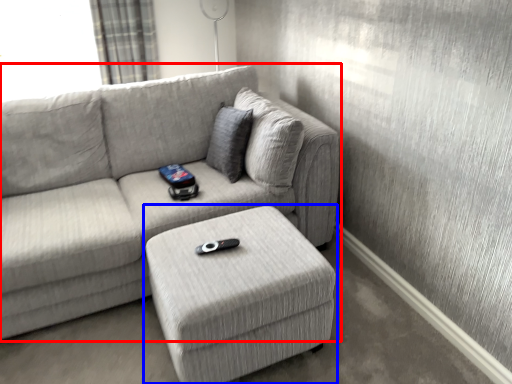
Question: Among these objects, which one is farthest to the camera, studio couch (highlighted by a red box) or table (highlighted by a blue box)?

Choices:
 (A) studio couch
 (B) table

Answer: (B)